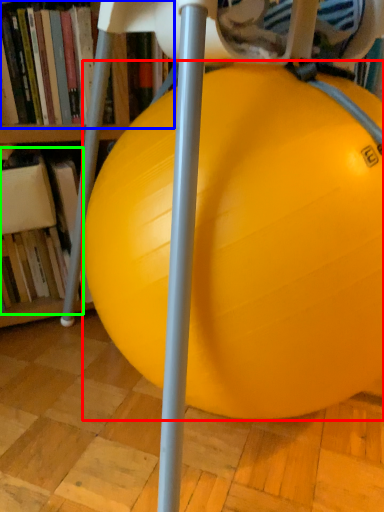
Question: Which is nearer to the ball (highlighted by a red box)? book (highlighted by a blue box) or book (highlighted by a green box).

Choices:
 (A) book
 (B) book

Answer: (A)